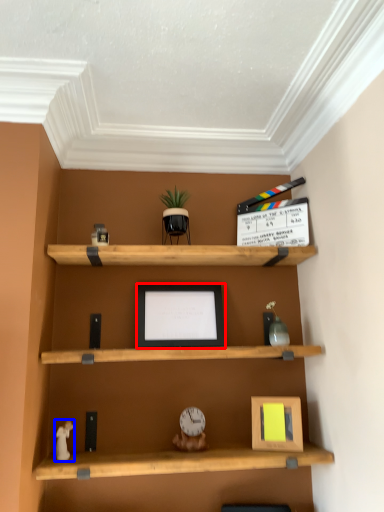
Question: Which of the following is the closest to the observer, picture frame (highlighted by a red box) or toy (highlighted by a blue box)?

Choices:
 (A) picture frame
 (B) toy

Answer: (B)